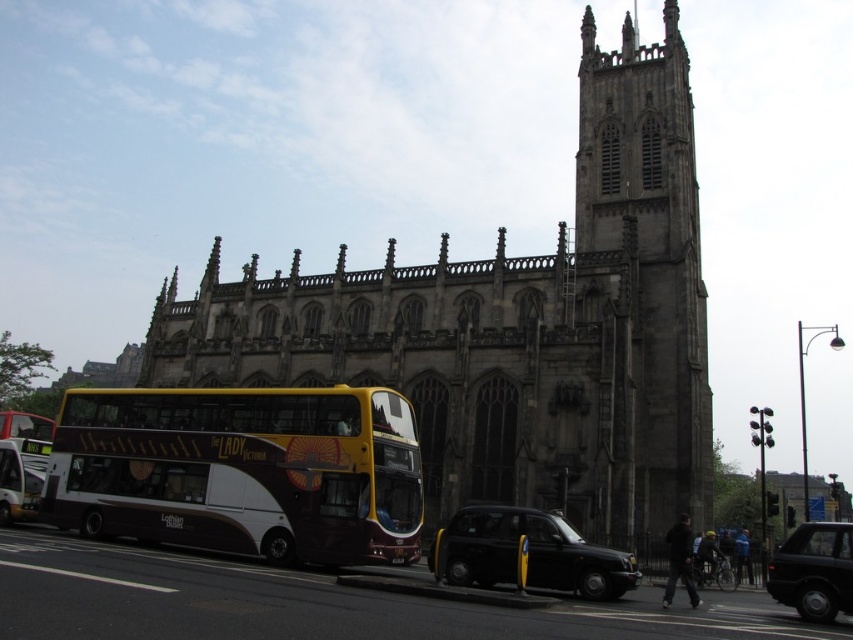
In the scene shown: Can you confirm if black rubber car at lower right is smaller than white matte bus at lower left?

No, black rubber car at lower right is not smaller than white matte bus at lower left.

Between black rubber car at lower right and white matte bus at lower left, which one has more height?

black rubber car at lower right

You are a GUI agent. You are given a task and a screenshot of the screen. Output one action in this format:
    pyautogui.click(x=<x>, y=<y>)
    Task: Click on the black rubber car at lower right
    This screenshot has height=640, width=853.
    Given the screenshot: What is the action you would take?
    pyautogui.click(x=814, y=570)

This screenshot has height=640, width=853. Find the location of `black rubber car at lower right`. black rubber car at lower right is located at coordinates (814, 570).

Between point (602, 561) and point (39, 432), which one is positioned in front?

Positioned in front is point (602, 561).

Who is higher up, black matte taxi at center or white matte bus at lower left?

white matte bus at lower left is above.

Is point (563, 541) more distant than point (18, 426)?

No, it is in front of (18, 426).

Identify the location of black matte taxi at center. The image size is (853, 640). (531, 552).

Is dark gray stone church at center behind black matte taxi at center?

Yes, it is behind black matte taxi at center.

Is point (612, 452) farther from camera compared to point (572, 529)?

Yes, it is behind point (572, 529).

Which is behind, point (144, 364) or point (555, 541)?

The point (144, 364) is behind.

The image size is (853, 640). What are the coordinates of `dark gray stone church at center` in the screenshot? It's located at (515, 326).